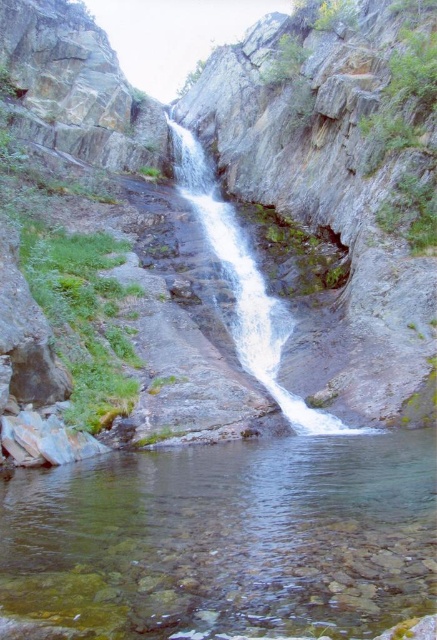
You are standing on a path behind the waterfall scene. You want to take a photo of the white frothy water at center without the clear glass water at center blocking the view. Is this possible?

The clear glass water at center is closer to the viewer than the white frothy water at center. Therefore, the clear glass water at center would block the view of the white frothy water at center, making it impossible to take a photo of the white frothy water at center without obstruction.

You are standing near the waterfall and want to cross the pool to reach the other side. The clear glass water at center is below the white frothy water at center. Which part of the water should you step on to avoid getting wet up to your knees?

You should step on the clear glass water at center because it is below the white frothy water at center and likely shallower, reducing the risk of getting wet up to your knees.